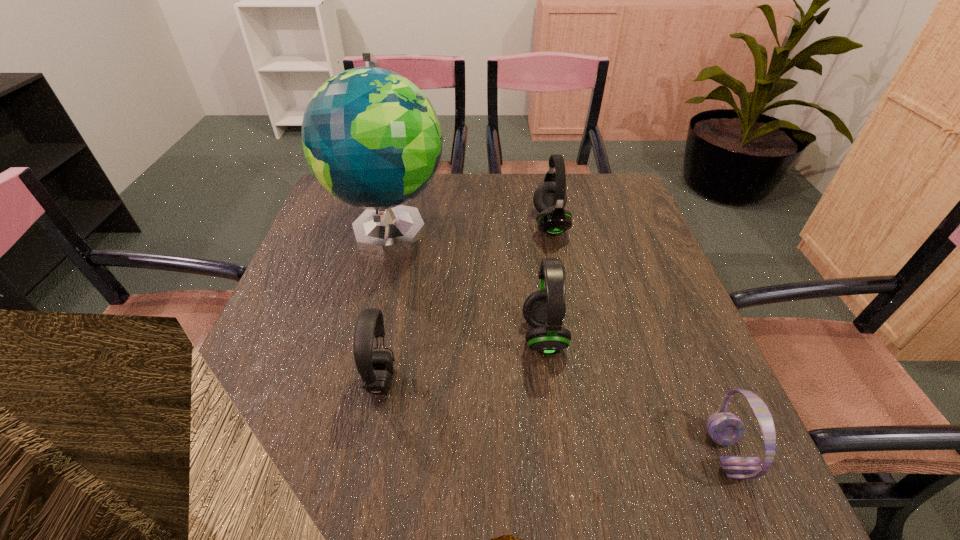
Find the location of a particular element. the tallest object is located at coordinates (371, 137).

Locate an element on the screen. the farthest headset is located at coordinates (550, 197).

Find the location of a particular element. the leftmost headset is located at coordinates (375, 368).

Image resolution: width=960 pixels, height=540 pixels. Identify the location of the nearest headset. (726, 429).

Find the location of a particular element. the rightmost object is located at coordinates (726, 429).

The height and width of the screenshot is (540, 960). Find the location of `vacant space located on the front surface of the tallest object`. vacant space located on the front surface of the tallest object is located at coordinates 356,368.

Locate an element on the screen. free space located 0.110m on the ear cups of the farthest headset is located at coordinates (493, 224).

You are a GUI agent. You are given a task and a screenshot of the screen. Output one action in this format:
    pyautogui.click(x=<x>, y=<y>)
    Task: Click on the vacant space located on the ear cups of the farthest headset
    The height and width of the screenshot is (540, 960).
    Given the screenshot: What is the action you would take?
    pyautogui.click(x=451, y=224)

This screenshot has height=540, width=960. What are the coordinates of `vacant space located 0.190m on the ear cups of the farthest headset` in the screenshot? It's located at (466, 224).

This screenshot has width=960, height=540. I want to click on vacant space located on the front-facing side of the leftmost headset, so click(x=539, y=380).